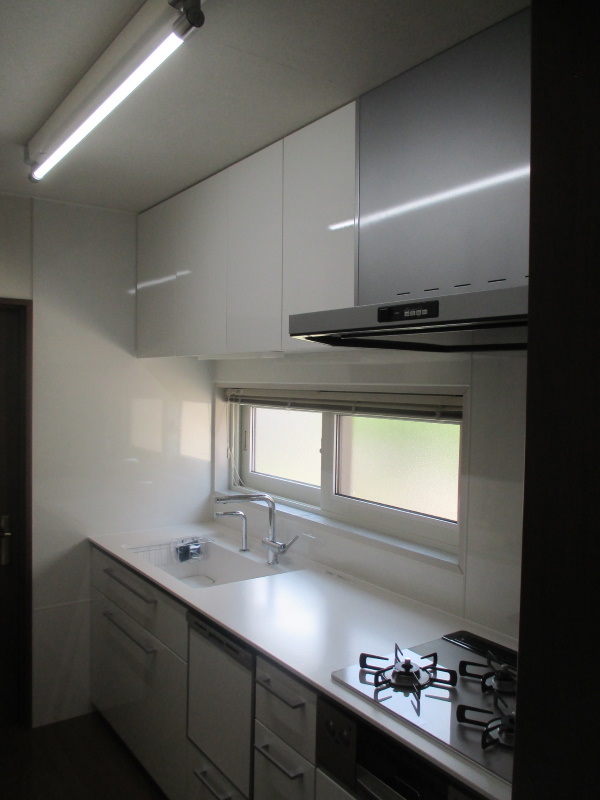
Where is `dishwashing machine`? Image resolution: width=600 pixels, height=800 pixels. dishwashing machine is located at coordinates (198, 685).